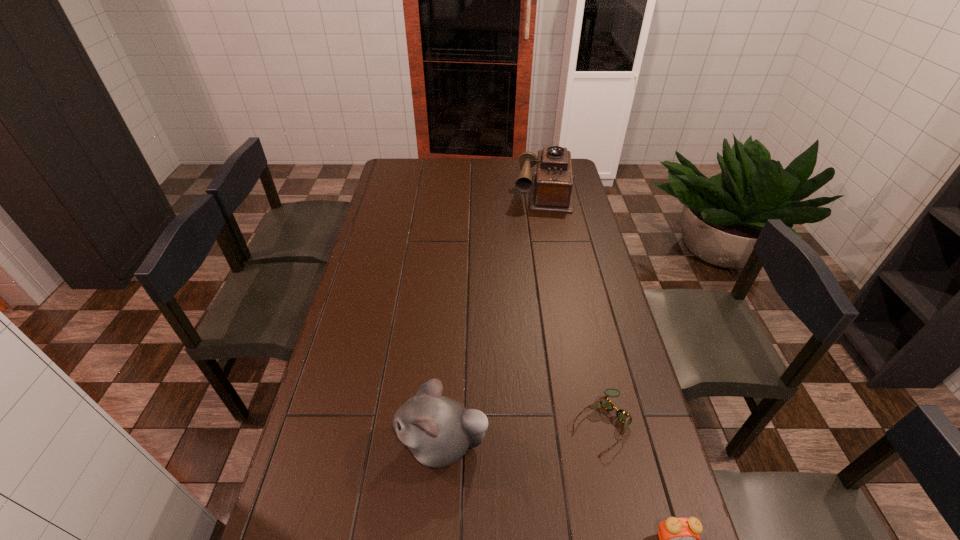
Where is `free space on the desktop that is between the leftmost object and the nearest object and is positioned on the front-facing side of the shortest object`? This screenshot has width=960, height=540. free space on the desktop that is between the leftmost object and the nearest object and is positioned on the front-facing side of the shortest object is located at coordinates (540, 485).

Find the location of a particular element. This screenshot has height=540, width=960. free space on the desktop that is between the leftmost object and the third tallest object and is positioned on the horn of the phonograph_record is located at coordinates (534, 482).